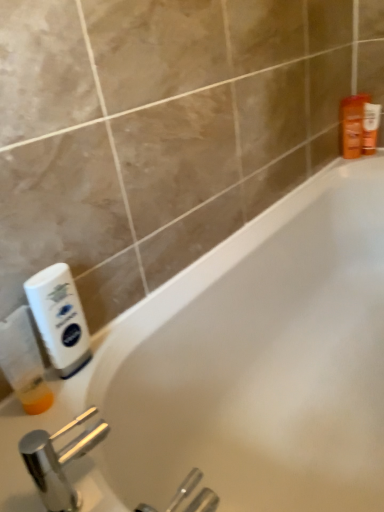
The height and width of the screenshot is (512, 384). Find the location of `vacant space behind polished chrome faucet at lower left`. vacant space behind polished chrome faucet at lower left is located at coordinates (71, 420).